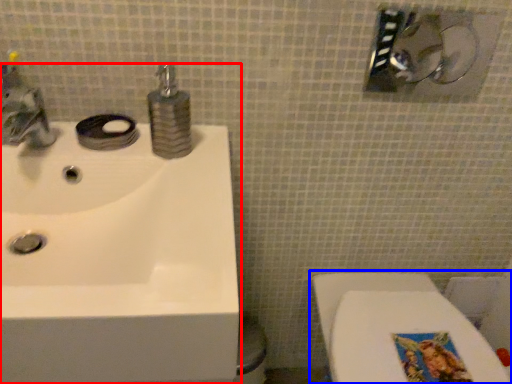
Question: Which object is closer to the camera taking this photo, sink (highlighted by a red box) or toilet (highlighted by a blue box)?

Choices:
 (A) sink
 (B) toilet

Answer: (A)